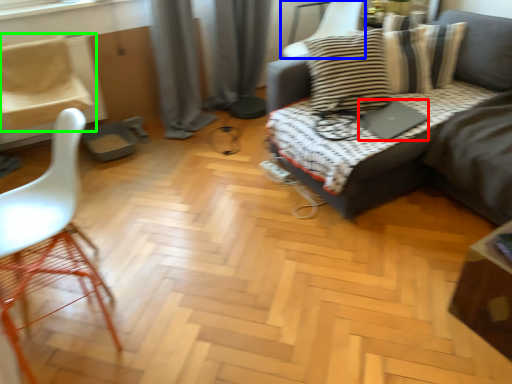
Question: Which object is positioned closest to laptop (highlighted by a red box)? Select from chair (highlighted by a blue box) and chair (highlighted by a green box).

Choices:
 (A) chair
 (B) chair

Answer: (A)